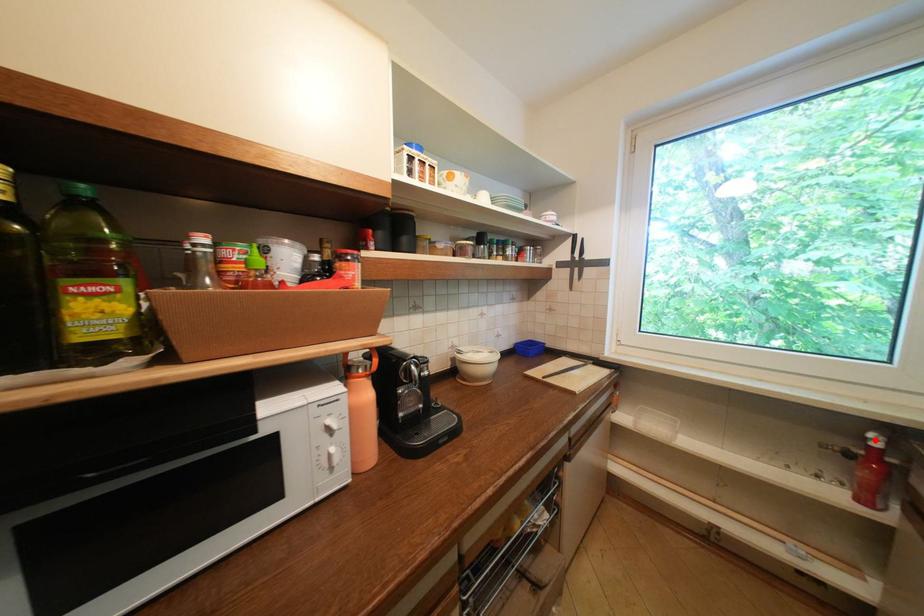
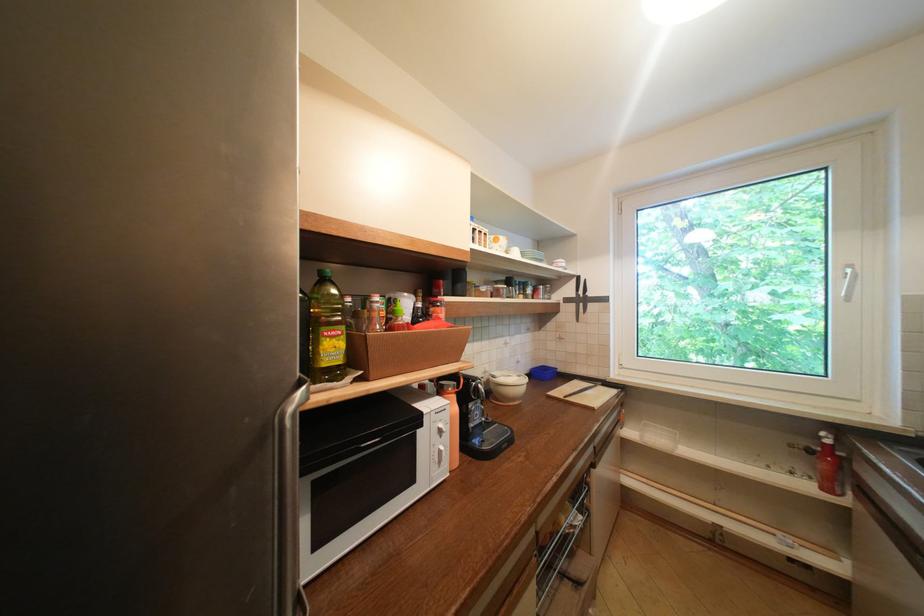
The point at the highlighted location is marked in the first image. Where is the corresponding point in the second image?

(829, 439)